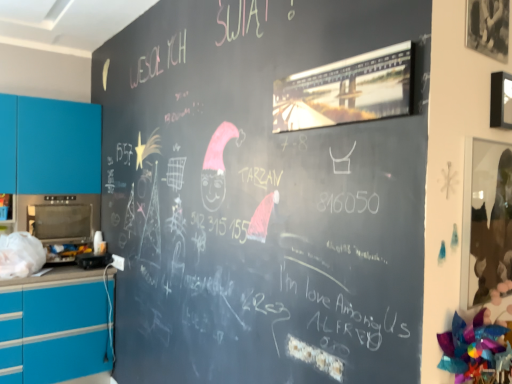
Question: From a real-world perspective, is metallic oven at left, the 2th appliance from the right, positioned above or below black plastic toaster at lower left, the second appliance positioned from the left?

Choices:
 (A) above
 (B) below

Answer: (A)

Question: From the image's perspective, relative to black plastic toaster at lower left, the second appliance positioned from the left, is metallic oven at left, the 1th appliance when ordered from left to right, above or below?

Choices:
 (A) below
 (B) above

Answer: (B)

Question: Estimate the real-world distances between objects in this image. Which object is farther from the metallic oven at left, which is counted as the 1th appliance, starting from the top?

Choices:
 (A) black plastic toaster at lower left, the 1th appliance positioned from the right
 (B) matte blue cabinet at left

Answer: (A)

Question: Estimate the real-world distances between objects in this image. Which object is farther from the matte blue cabinet at left?

Choices:
 (A) metallic oven at left, the 2th appliance from the right
 (B) black plastic toaster at lower left, the 1th appliance positioned from the right

Answer: (B)